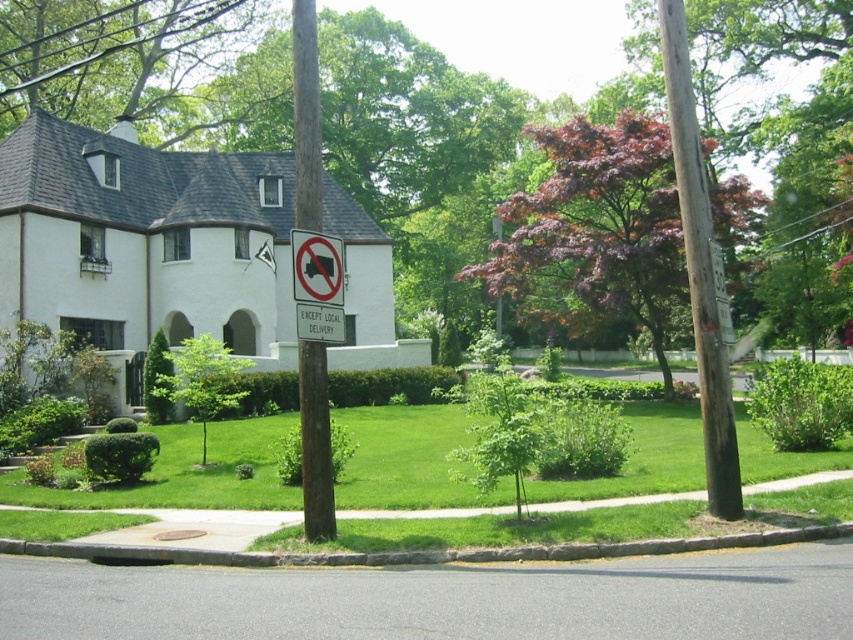
Question: Can you confirm if brown wooden telegraph pole at center is wider than white plastic sign at center?

Choices:
 (A) no
 (B) yes

Answer: (B)

Question: Which object appears farthest from the camera in this image?

Choices:
 (A) brown wooden telegraph pole at center
 (B) green leafy tree at upper left

Answer: (B)

Question: Does purple leafy tree at center have a lesser width compared to purple glossy tree at center?

Choices:
 (A) no
 (B) yes

Answer: (A)

Question: Which of the following is the closest to the observer?

Choices:
 (A) green leafy tree at upper left
 (B) brown wooden telegraph pole at center

Answer: (B)

Question: Is green leafy tree at upper left positioned before brown wooden telegraph pole at center?

Choices:
 (A) yes
 (B) no

Answer: (B)

Question: Which point is farther to the camera?

Choices:
 (A) tap(552, 147)
 (B) tap(315, 204)

Answer: (A)